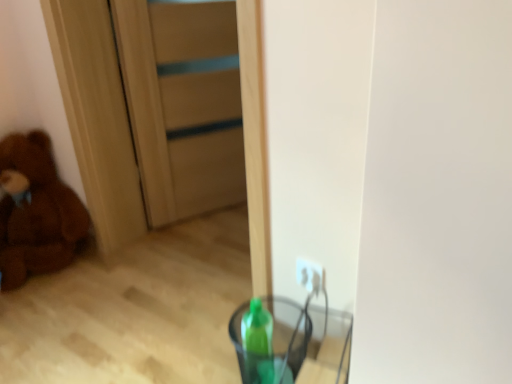
Question: Can you confirm if brown plush teddy bear at left is thinner than transparent plastic cup at lower center?

Choices:
 (A) yes
 (B) no

Answer: (B)

Question: Can you confirm if brown plush teddy bear at left is positioned to the left of transparent plastic cup at lower center?

Choices:
 (A) no
 (B) yes

Answer: (B)

Question: Is brown plush teddy bear at left not close to transparent plastic cup at lower center?

Choices:
 (A) yes
 (B) no

Answer: (A)

Question: Is brown plush teddy bear at left turned away from transparent plastic cup at lower center?

Choices:
 (A) no
 (B) yes

Answer: (A)

Question: From a real-world perspective, is brown plush teddy bear at left located higher than transparent plastic cup at lower center?

Choices:
 (A) no
 (B) yes

Answer: (B)

Question: Is brown plush teddy bear at left touching transparent plastic cup at lower center?

Choices:
 (A) yes
 (B) no

Answer: (B)

Question: Does transparent plastic cup at lower center have a greater width compared to brown plush teddy bear at left?

Choices:
 (A) no
 (B) yes

Answer: (A)

Question: Is the depth of transparent plastic cup at lower center greater than that of brown plush teddy bear at left?

Choices:
 (A) yes
 (B) no

Answer: (B)

Question: Is brown plush teddy bear at left a part of transparent plastic cup at lower center?

Choices:
 (A) yes
 (B) no

Answer: (B)

Question: Considering the relative sizes of transparent plastic cup at lower center and brown plush teddy bear at left in the image provided, is transparent plastic cup at lower center shorter than brown plush teddy bear at left?

Choices:
 (A) yes
 (B) no

Answer: (A)

Question: Is transparent plastic cup at lower center positioned with its back to brown plush teddy bear at left?

Choices:
 (A) yes
 (B) no

Answer: (B)

Question: Is there a large distance between transparent plastic cup at lower center and brown plush teddy bear at left?

Choices:
 (A) yes
 (B) no

Answer: (A)

Question: From the image's perspective, is transparent plastic cup at lower center below wooden door at center?

Choices:
 (A) no
 (B) yes

Answer: (B)